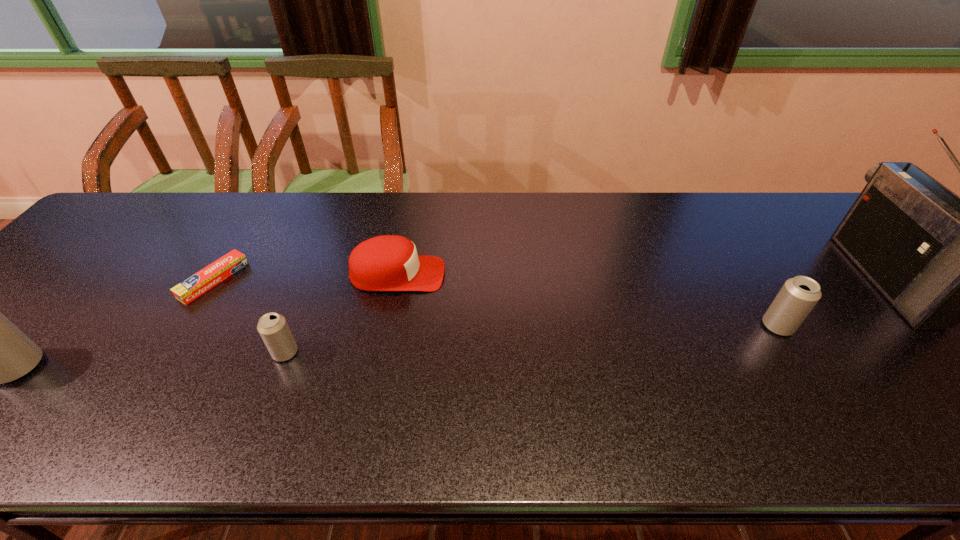
The width and height of the screenshot is (960, 540). What are the coordinates of `free space between the third object from right to left and the second object from right to left` in the screenshot? It's located at (588, 300).

At what (x,y) coordinates should I click in order to perform the action: click on object identified as the fifth closest to the tallest beer can. Please return your answer as a coordinate pair (x, y). Looking at the image, I should click on (939, 259).

At what (x,y) coordinates should I click in order to perform the action: click on object that can be found as the third closest to the fourth object from left to right. Please return your answer as a coordinate pair (x, y). The image size is (960, 540). Looking at the image, I should click on (0, 352).

Identify which beer can is located as the nearest to the tallest object. Please provide its 2D coordinates. Your answer should be formatted as a tuple, i.e. [(x, y)], where the tuple contains the x and y coordinates of a point satisfying the conditions above.

[(798, 296)]

I want to click on the third closest beer can to the shortest object, so click(798, 296).

Where is `free spot that satisfies the following two spatial constraints: 1. on the front-facing side of the baseball cap; 2. on the right side of the rightmost beer can`? The width and height of the screenshot is (960, 540). free spot that satisfies the following two spatial constraints: 1. on the front-facing side of the baseball cap; 2. on the right side of the rightmost beer can is located at coordinates pos(387,326).